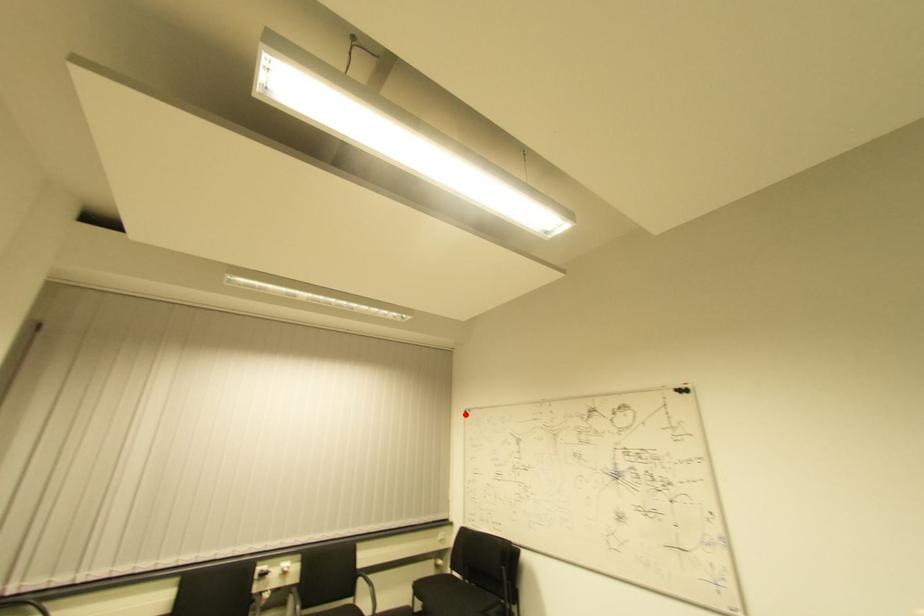
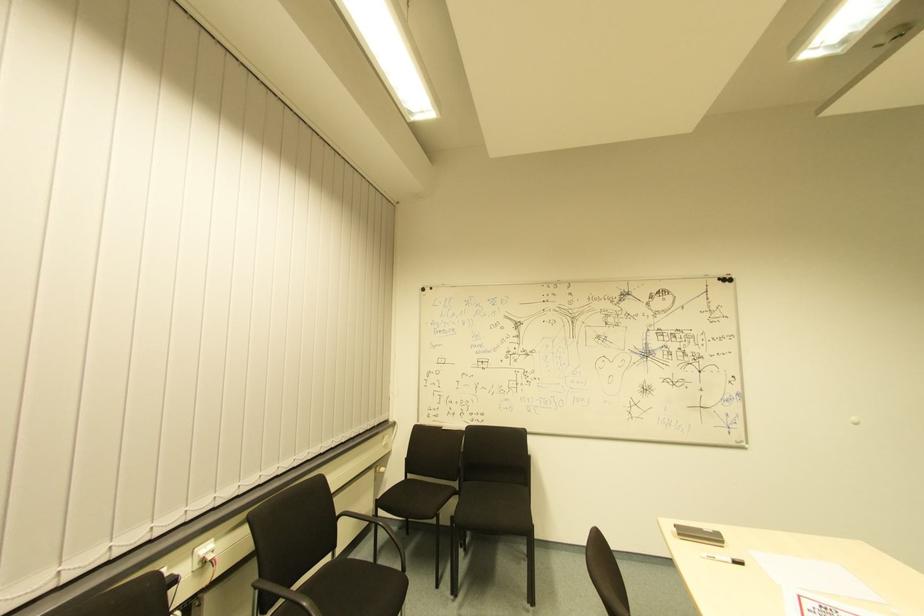
Question: I am providing you with two images of the same scene from different viewpoints. A red point is marked on the first image. At the location where the point appears in image 1, is it still visible in image 2?

Choices:
 (A) Yes
 (B) No

Answer: (A)